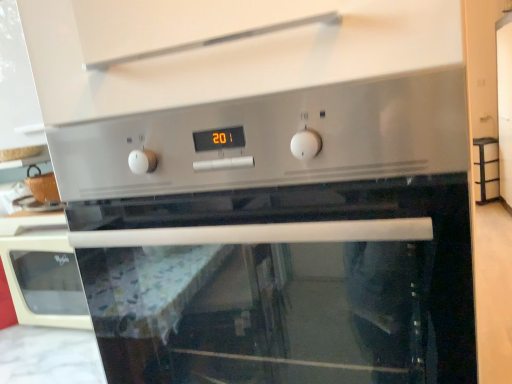
Question: Should I look upward or downward to see satin silver oven at center?

Choices:
 (A) up
 (B) down

Answer: (B)